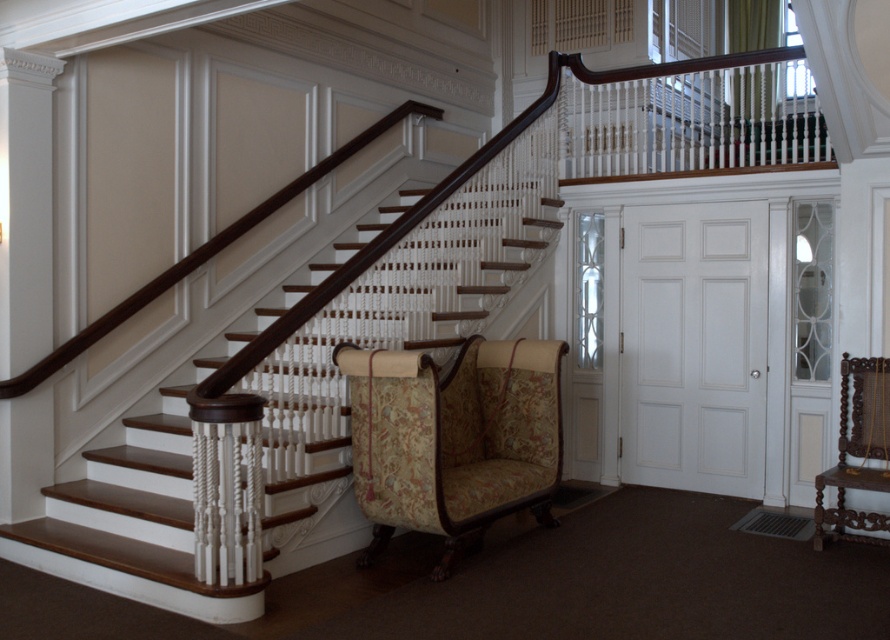
Measure the distance between point (123, 492) and camera.

Point (123, 492) is 16.23 feet from camera.

Between wooden staircase at center and patterned fabric armchair at center, which one has more height?

wooden staircase at center is taller.

Which is in front, point (178, 554) or point (524, 481)?

Positioned in front is point (178, 554).

Locate an element on the screen. This screenshot has height=640, width=890. wooden staircase at center is located at coordinates (134, 522).

How far apart are patterned fabric armchair at center and carved wood armchair at lower right?

patterned fabric armchair at center is 7.45 feet from carved wood armchair at lower right.

Which is more to the left, patterned fabric armchair at center or carved wood armchair at lower right?

From the viewer's perspective, patterned fabric armchair at center appears more on the left side.

Between point (359, 563) and point (867, 486), which one is positioned behind?

Point (359, 563)

Identify the location of patterned fabric armchair at center. The height and width of the screenshot is (640, 890). (452, 438).

Between point (191, 500) and point (843, 460), which one is positioned in front?

Point (191, 500)

Who is higher up, wooden staircase at center or carved wood armchair at lower right?

Positioned higher is wooden staircase at center.

Is point (168, 552) closer to viewer compared to point (842, 538)?

Yes, it is.

Identify the location of wooden staircase at center. (134, 522).